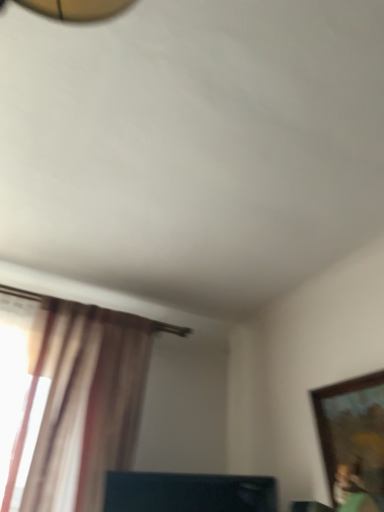
What do you see at coordinates (353, 441) in the screenshot? I see `wooden picture frame at upper right` at bounding box center [353, 441].

At what (x,y) coordinates should I click in order to perform the action: click on wooden picture frame at upper right. Please return your answer as a coordinate pair (x, y). Image resolution: width=384 pixels, height=512 pixels. Looking at the image, I should click on (353, 441).

Where is `wooden picture frame at upper right`? The image size is (384, 512). wooden picture frame at upper right is located at coordinates (353, 441).